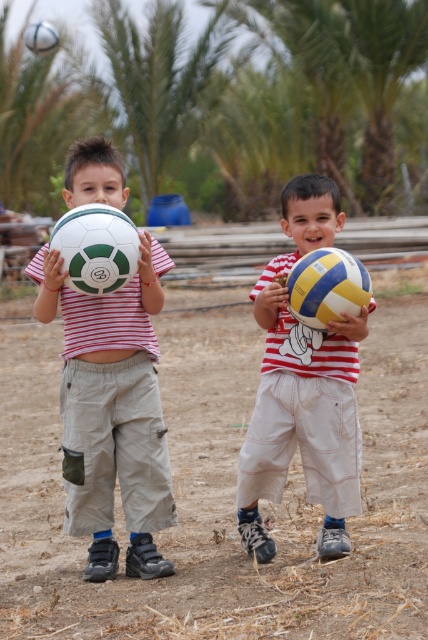
Question: Does matte green and white soccer ball at left have a lesser width compared to white matte soccer ball at left?

Choices:
 (A) no
 (B) yes

Answer: (A)

Question: Does yellow and blue textured volleyball at center lie behind white matte soccer ball at upper left?

Choices:
 (A) yes
 (B) no

Answer: (B)

Question: Which point is closer to the camera?

Choices:
 (A) yellow and blue textured volleyball at center
 (B) matte yellow and blue volleyball at center
 (C) white matte soccer ball at upper left
 (D) matte green and white soccer ball at left

Answer: (A)

Question: Does matte green and white soccer ball at left have a greater width compared to yellow and blue textured volleyball at center?

Choices:
 (A) no
 (B) yes

Answer: (B)

Question: Which of the following is the closest to the observer?

Choices:
 (A) yellow and blue textured volleyball at center
 (B) white matte soccer ball at upper left
 (C) brown dirt field at center
 (D) white matte soccer ball at left

Answer: (A)

Question: Which point is closer to the camera?

Choices:
 (A) brown dirt field at center
 (B) matte green and white soccer ball at left

Answer: (B)